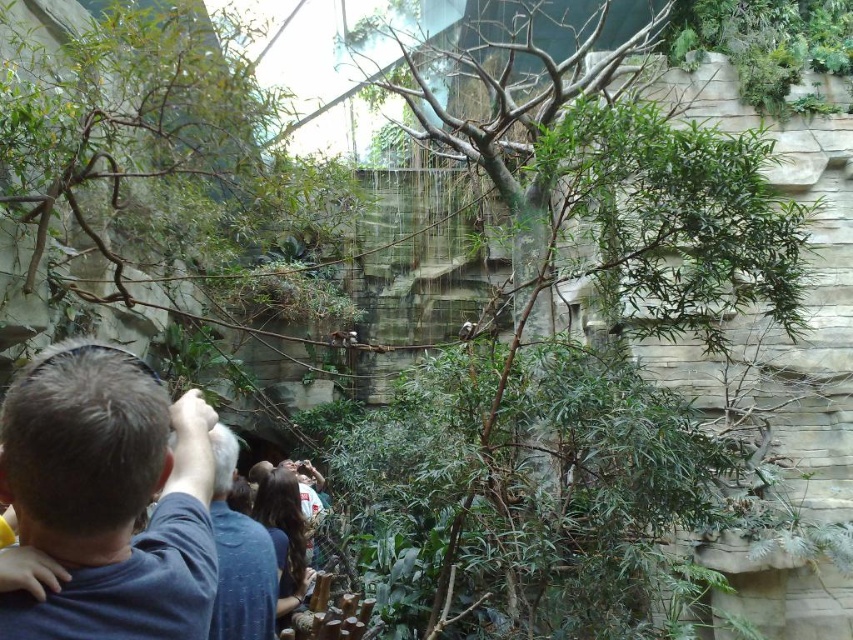
Question: From the image, what is the correct spatial relationship of green leafy tree at center in relation to dark brown hair at center?

Choices:
 (A) below
 (B) above

Answer: (B)

Question: Can you confirm if dark blue shirt at center is bigger than dark brown hair at center?

Choices:
 (A) yes
 (B) no

Answer: (A)

Question: Among these points, which one is nearest to the camera?

Choices:
 (A) [x=131, y=429]
 (B) [x=730, y=260]

Answer: (A)

Question: Which of the following is the closest to the observer?

Choices:
 (A) dark brown hair at center
 (B) dark blue shirt at lower left
 (C) green leafy tree at center

Answer: (B)

Question: From the image, what is the correct spatial relationship of dark blue shirt at lower left in relation to dark brown hair at center?

Choices:
 (A) right
 (B) left

Answer: (B)

Question: Considering the real-world distances, which object is closest to the dark blue shirt at center?

Choices:
 (A) dark brown hair at center
 (B) dark blue shirt at lower left

Answer: (B)